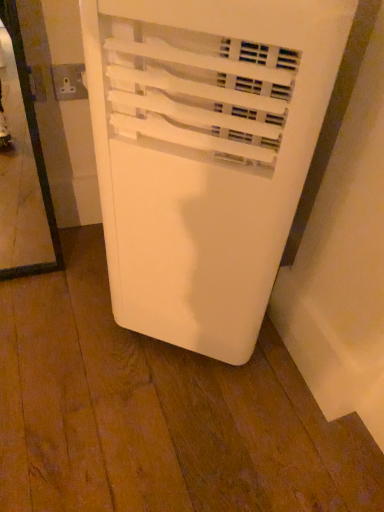
Describe the element at coordinates (205, 154) in the screenshot. I see `white plastic air conditioner at center` at that location.

What is the approximate height of white plastic air conditioner at center?

30.74 inches.

Identify the location of white plastic air conditioner at center. (205, 154).

This screenshot has height=512, width=384. In order to click on white plastic socket at upper left in this screenshot , I will do `click(69, 82)`.

What is the approximate width of white plastic socket at upper left?

The width of white plastic socket at upper left is 0.42 inches.

The height and width of the screenshot is (512, 384). What do you see at coordinates (69, 82) in the screenshot?
I see `white plastic socket at upper left` at bounding box center [69, 82].

The width and height of the screenshot is (384, 512). I want to click on white plastic air conditioner at center, so click(205, 154).

Considering the positions of objects white plastic socket at upper left and white plastic air conditioner at center in the image provided, who is more to the left, white plastic socket at upper left or white plastic air conditioner at center?

Positioned to the left is white plastic socket at upper left.

Relative to white plastic air conditioner at center, is white plastic socket at upper left in front or behind?

white plastic socket at upper left is behind white plastic air conditioner at center.

Is point (62, 68) farther from viewer compared to point (218, 313)?

Yes.

Based on the photo, from the image's perspective, would you say white plastic socket at upper left is positioned over white plastic air conditioner at center?

Correct, white plastic socket at upper left appears higher than white plastic air conditioner at center in the image.

From a real-world perspective, is white plastic socket at upper left positioned above or below white plastic air conditioner at center?

white plastic socket at upper left is situated higher than white plastic air conditioner at center in the real world.

Between white plastic socket at upper left and white plastic air conditioner at center, which one has smaller width?

Thinner between the two is white plastic socket at upper left.

Which of these two, white plastic socket at upper left or white plastic air conditioner at center, stands taller?

white plastic air conditioner at center.

In terms of size, does white plastic socket at upper left appear bigger or smaller than white plastic air conditioner at center?

white plastic socket at upper left is smaller than white plastic air conditioner at center.

Is white plastic air conditioner at center completely or partially inside white plastic socket at upper left?

No, white plastic socket at upper left does not contain white plastic air conditioner at center.

Are white plastic socket at upper left and white plastic air conditioner at center located far from each other?

white plastic socket at upper left is actually quite close to white plastic air conditioner at center.

Is white plastic socket at upper left oriented away from white plastic air conditioner at center?

No, white plastic socket at upper left is not facing away from white plastic air conditioner at center.

How far apart are white plastic socket at upper left and white plastic air conditioner at center?

white plastic socket at upper left is 21.63 inches from white plastic air conditioner at center.

Where is `electric outlet above the white plastic air conditioner at center (from a real-world perspective)`? electric outlet above the white plastic air conditioner at center (from a real-world perspective) is located at coordinates (69, 82).

Which object is positioned more to the right, white plastic air conditioner at center or white plastic socket at upper left?

white plastic air conditioner at center.

Which is in front, white plastic air conditioner at center or white plastic socket at upper left?

white plastic air conditioner at center is closer to the camera.

Which point is more distant from viewer, (228, 124) or (74, 92)?

Positioned behind is point (74, 92).

From the image's perspective, who appears lower, white plastic air conditioner at center or white plastic socket at upper left?

white plastic air conditioner at center is shown below in the image.

From a real-world perspective, which object rests below the other?

white plastic air conditioner at center is physically lower.

Is white plastic air conditioner at center wider than white plastic socket at upper left?

Indeed, white plastic air conditioner at center has a greater width compared to white plastic socket at upper left.

Considering the relative sizes of white plastic air conditioner at center and white plastic socket at upper left in the image provided, is white plastic air conditioner at center taller than white plastic socket at upper left?

Yes.

Who is bigger, white plastic air conditioner at center or white plastic socket at upper left?

white plastic air conditioner at center is bigger.

Would you say white plastic air conditioner at center is inside or outside white plastic socket at upper left?

white plastic air conditioner at center cannot be found inside white plastic socket at upper left.

In the scene shown: Is white plastic air conditioner at center not close to white plastic socket at upper left?

No.

Could you tell me if white plastic air conditioner at center is facing white plastic socket at upper left?

No, white plastic air conditioner at center is not aimed at white plastic socket at upper left.

How many degrees apart are the facing directions of white plastic air conditioner at center and white plastic socket at upper left?

The facing directions of white plastic air conditioner at center and white plastic socket at upper left are 88 degrees apart.

Where is `home appliance that appears below the white plastic socket at upper left (from the image's perspective)`? This screenshot has width=384, height=512. home appliance that appears below the white plastic socket at upper left (from the image's perspective) is located at coordinates click(205, 154).

Find the location of a particular element. The image size is (384, 512). home appliance below the white plastic socket at upper left (from the image's perspective) is located at coordinates (205, 154).

What are the coordinates of `electric outlet located above the white plastic air conditioner at center (from the image's perspective)` in the screenshot? It's located at (69, 82).